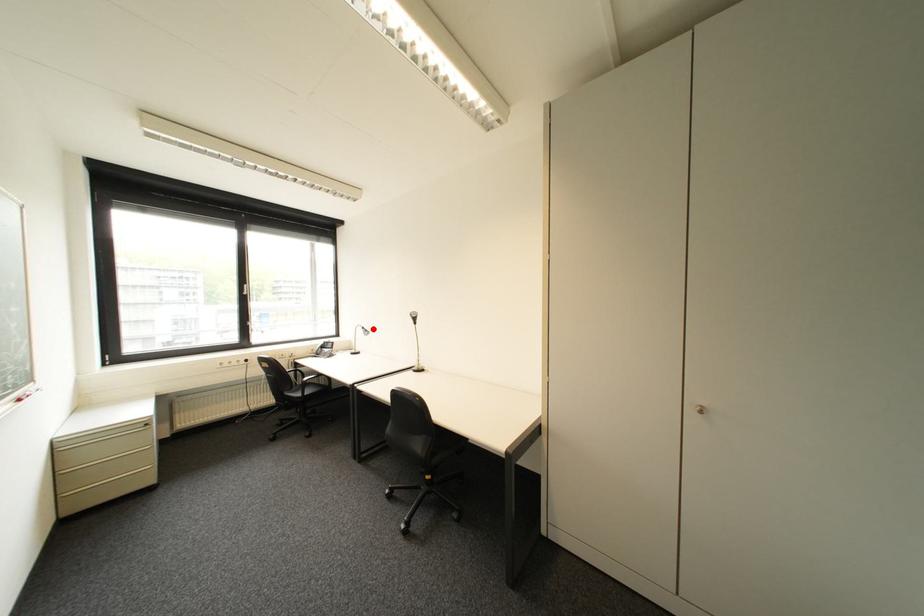
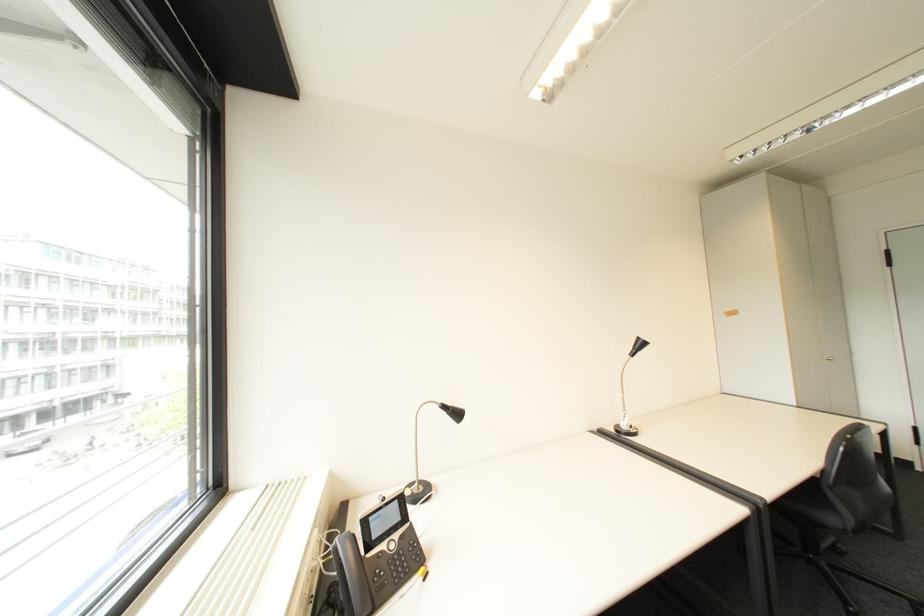
Question: I am providing you with two images of the same scene from different viewpoints. In image1, a red point is highlighted. Considering the same 3D point in image2, which of the following is correct?

Choices:
 (A) It is closer
 (B) It is farther

Answer: (A)